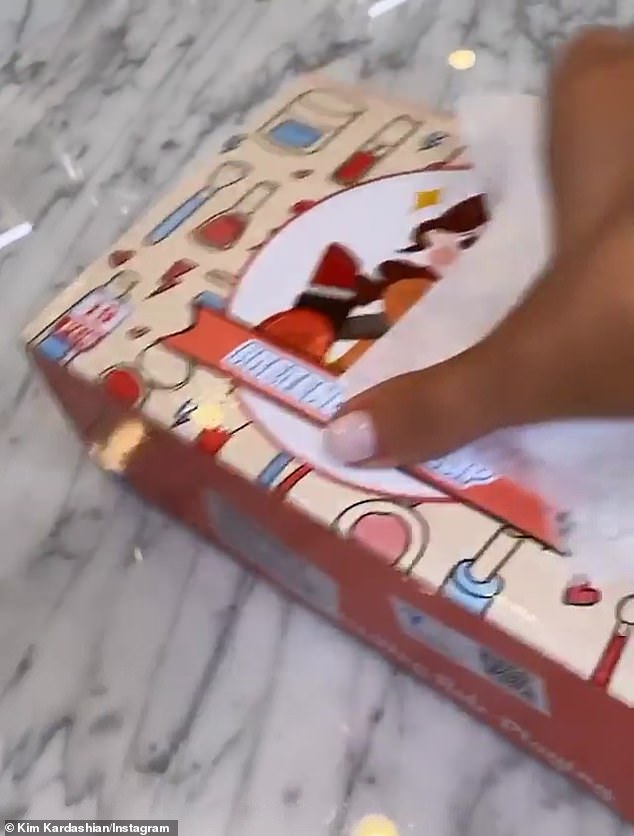
Find the location of a particular element. The image size is (634, 836). makeup brush is located at coordinates (226, 171).